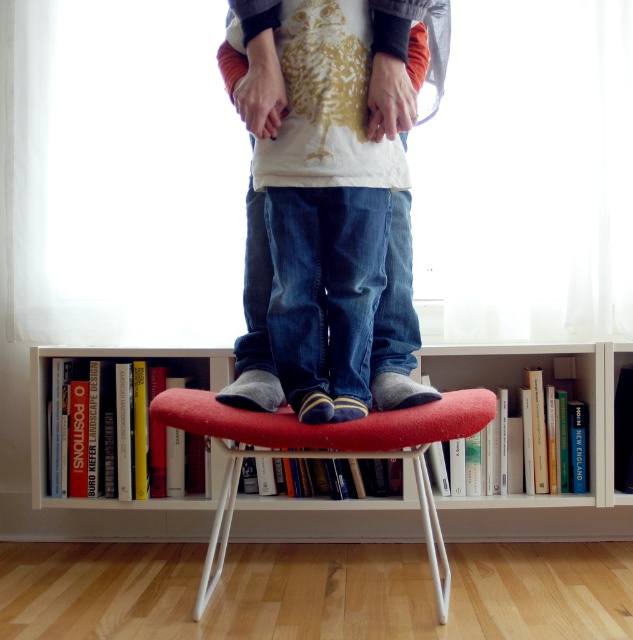
Question: Can you confirm if red fabric stool at center is bigger than denim jeans at center?

Choices:
 (A) yes
 (B) no

Answer: (A)

Question: Does white wood bookcase at center have a smaller size compared to denim jeans at center?

Choices:
 (A) no
 (B) yes

Answer: (A)

Question: Among these points, which one is farthest from the camera?

Choices:
 (A) (242, 401)
 (B) (341, 445)
 (C) (523, 356)

Answer: (C)

Question: Based on their relative distances, which object is nearer to the red fabric stool at center?

Choices:
 (A) denim jeans at center
 (B) white wood bookcase at center

Answer: (A)

Question: Does red fabric stool at center have a greater width compared to denim jeans at center?

Choices:
 (A) yes
 (B) no

Answer: (A)

Question: Which point is closer to the camera?

Choices:
 (A) red fabric stool at center
 (B) white wood bookcase at center

Answer: (A)